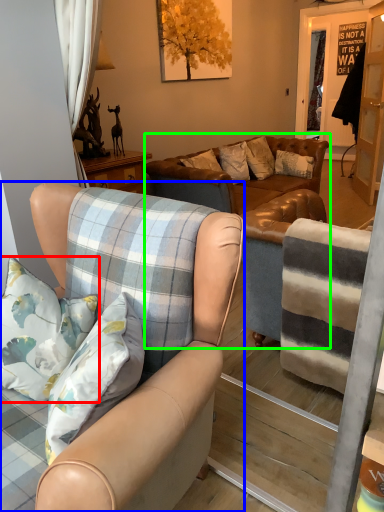
Question: Which object is the farthest from pillow (highlighted by a red box)? Choose among these: chair (highlighted by a blue box) or studio couch (highlighted by a green box).

Choices:
 (A) chair
 (B) studio couch

Answer: (B)